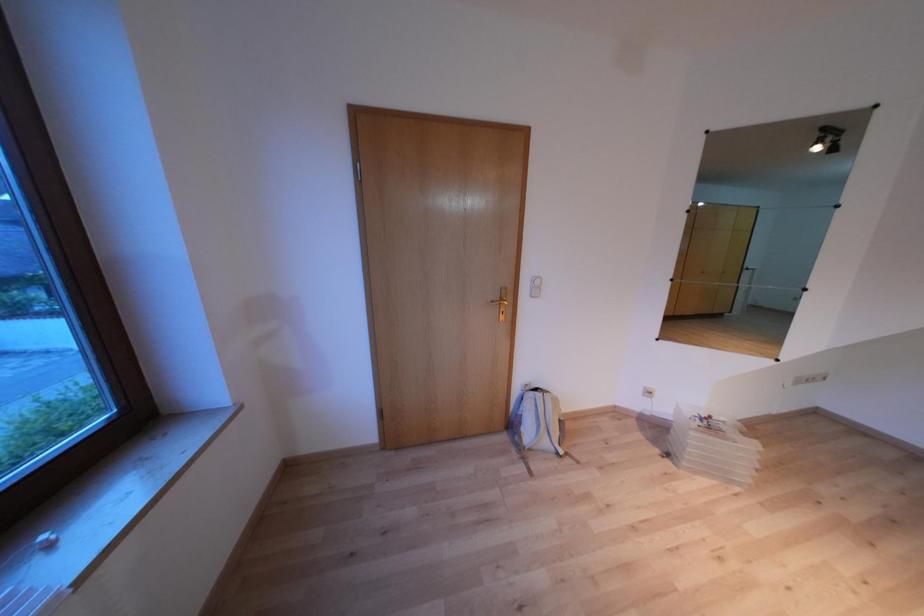
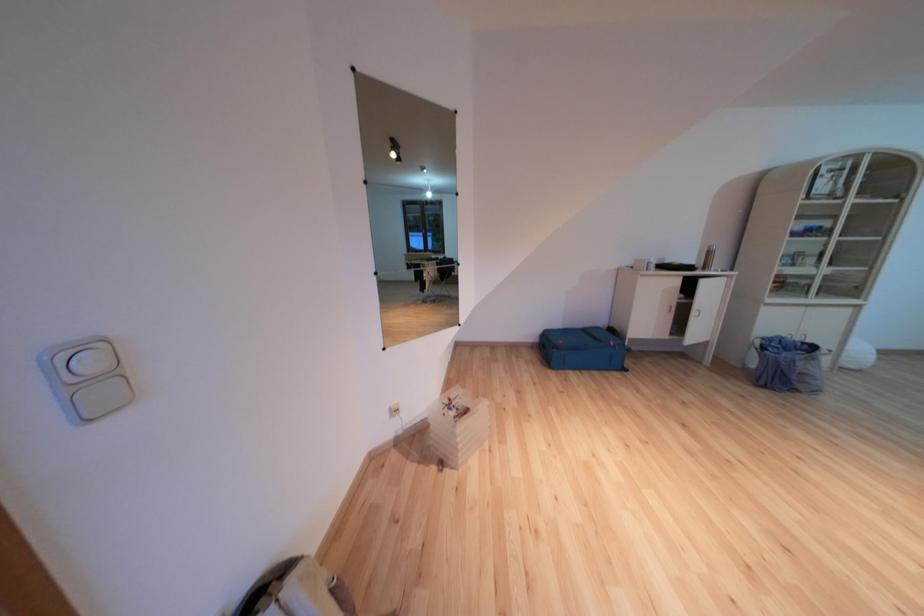
Question: The first image is from the beginning of the video and the second image is from the end. How did the camera likely rotate when shooting the video?

Choices:
 (A) Left
 (B) Right
 (C) Up
 (D) Down

Answer: (B)